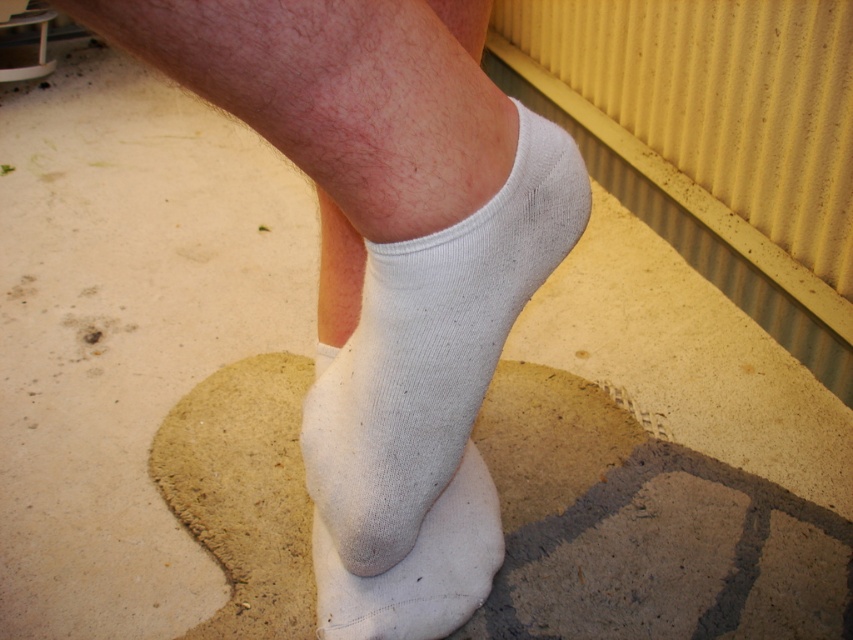
Does white cotton socks at center appear on the left side of white cotton sock at lower center?

Indeed, white cotton socks at center is positioned on the left side of white cotton sock at lower center.

Can you confirm if white cotton socks at center is shorter than white cotton sock at lower center?

Incorrect, white cotton socks at center's height does not fall short of white cotton sock at lower center's.

What do you see at coordinates (387, 266) in the screenshot?
I see `white cotton socks at center` at bounding box center [387, 266].

Identify the location of white cotton socks at center. (387, 266).

Which is more to the right, white cotton socks at center or white cotton sock at center?

white cotton socks at center

Can you confirm if white cotton socks at center is shorter than white cotton sock at center?

Incorrect, white cotton socks at center's height does not fall short of white cotton sock at center's.

Which is in front, point (320, 26) or point (421, 467)?

Positioned in front is point (320, 26).

Find the location of a particular element. This screenshot has width=853, height=640. white cotton socks at center is located at coordinates (387, 266).

What do you see at coordinates (432, 349) in the screenshot? The width and height of the screenshot is (853, 640). I see `white cotton sock at center` at bounding box center [432, 349].

Is point (434, 381) farther from camera compared to point (341, 620)?

No, (434, 381) is in front of (341, 620).

Identify the location of white cotton sock at center. The width and height of the screenshot is (853, 640). click(x=432, y=349).